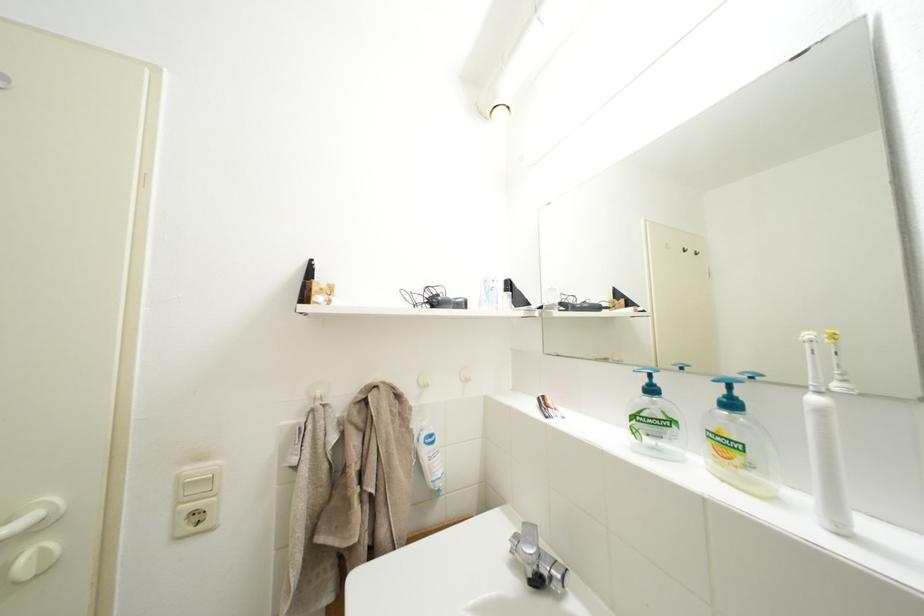
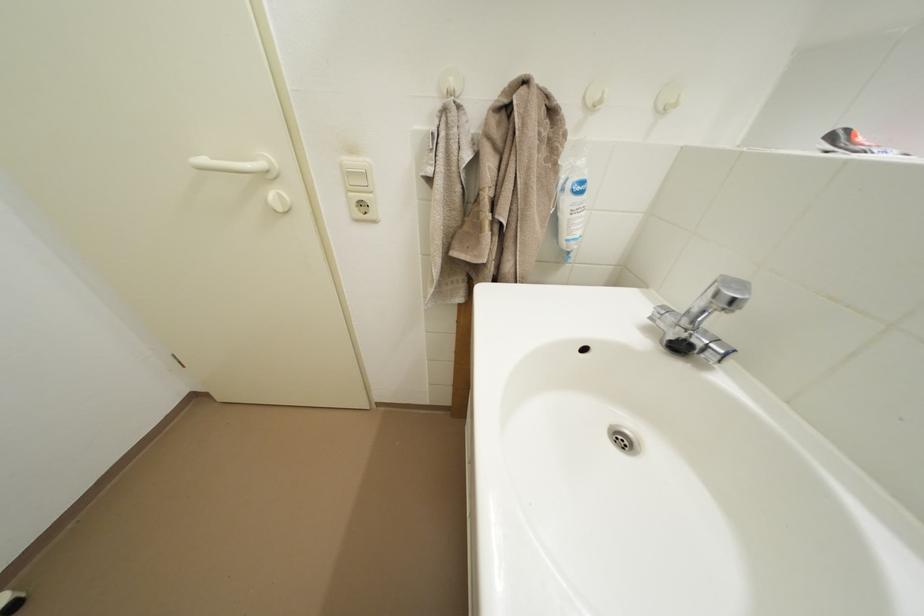
Based on the continuous images, in which direction is the camera rotating?

The camera rotated toward left-down.